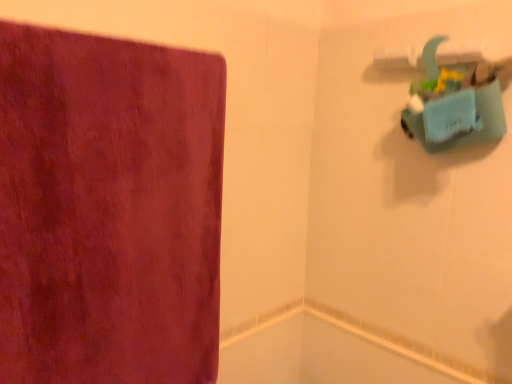
Measure the distance between point (301, 343) and camera.

Point (301, 343) and camera are 1.33 meters apart from each other.

I want to click on white glossy bath at lower center, so click(x=323, y=353).

What do you see at coordinates (323, 353) in the screenshot?
I see `white glossy bath at lower center` at bounding box center [323, 353].

What do you see at coordinates (108, 209) in the screenshot?
I see `velvet-like maroon towel at left` at bounding box center [108, 209].

The height and width of the screenshot is (384, 512). Identify the location of velvet-like maroon towel at left. (108, 209).

The height and width of the screenshot is (384, 512). What are the coordinates of `white glossy bath at lower center` in the screenshot? It's located at (323, 353).

Is velvet-like maroon towel at left at the right side of white glossy bath at lower center?

In fact, velvet-like maroon towel at left is to the left of white glossy bath at lower center.

Is velvet-like maroon towel at left positioned behind white glossy bath at lower center?

No, velvet-like maroon towel at left is closer to the viewer.

Considering the positions of point (150, 67) and point (333, 330), is point (150, 67) closer or farther from the camera than point (333, 330)?

Point (150, 67).

From the image's perspective, does velvet-like maroon towel at left appear lower than white glossy bath at lower center?

Actually, velvet-like maroon towel at left appears above white glossy bath at lower center in the image.

From a real-world perspective, who is located lower, velvet-like maroon towel at left or white glossy bath at lower center?

white glossy bath at lower center, from a real-world perspective.

Does velvet-like maroon towel at left have a lesser width compared to white glossy bath at lower center?

No, velvet-like maroon towel at left is not thinner than white glossy bath at lower center.

Who is taller, velvet-like maroon towel at left or white glossy bath at lower center?

Standing taller between the two is velvet-like maroon towel at left.

Is velvet-like maroon towel at left smaller than white glossy bath at lower center?

No, velvet-like maroon towel at left is not smaller than white glossy bath at lower center.

Can white glossy bath at lower center be found inside velvet-like maroon towel at left?

Actually, white glossy bath at lower center is outside velvet-like maroon towel at left.

Is velvet-like maroon towel at left placed right next to white glossy bath at lower center?

There is a gap between velvet-like maroon towel at left and white glossy bath at lower center.

Is velvet-like maroon towel at left positioned with its back to white glossy bath at lower center?

velvet-like maroon towel at left is not turned away from white glossy bath at lower center.

How many degrees apart are the facing directions of velvet-like maroon towel at left and white glossy bath at lower center?

90.1 degrees.

Measure the distance between velvet-like maroon towel at left and white glossy bath at lower center.

A distance of 20.97 inches exists between velvet-like maroon towel at left and white glossy bath at lower center.

Identify the location of towel in front of the white glossy bath at lower center. (108, 209).

Between white glossy bath at lower center and velvet-like maroon towel at left, which one appears on the right side from the viewer's perspective?

white glossy bath at lower center.

Between white glossy bath at lower center and velvet-like maroon towel at left, which one is positioned in front?

velvet-like maroon towel at left is in front.

Is point (366, 357) positioned in front of point (173, 305)?

No.

From the image's perspective, who appears lower, white glossy bath at lower center or velvet-like maroon towel at left?

From the image's view, white glossy bath at lower center is below.

From a real-world perspective, is white glossy bath at lower center on velvet-like maroon towel at left?

No, from a real-world perspective, white glossy bath at lower center is not over velvet-like maroon towel at left

Is white glossy bath at lower center wider or thinner than velvet-like maroon towel at left?

white glossy bath at lower center is thinner than velvet-like maroon towel at left.

Is white glossy bath at lower center taller or shorter than velvet-like maroon towel at left?

Considering their sizes, white glossy bath at lower center has less height than velvet-like maroon towel at left.

In terms of size, does white glossy bath at lower center appear bigger or smaller than velvet-like maroon towel at left?

Considering their sizes, white glossy bath at lower center takes up less space than velvet-like maroon towel at left.

Can we say white glossy bath at lower center lies outside velvet-like maroon towel at left?

Indeed, white glossy bath at lower center is completely outside velvet-like maroon towel at left.

Is there a large distance between white glossy bath at lower center and velvet-like maroon towel at left?

No, there isn't a large distance between white glossy bath at lower center and velvet-like maroon towel at left.

Is white glossy bath at lower center aimed at velvet-like maroon towel at left?

No, white glossy bath at lower center is not turned towards velvet-like maroon towel at left.

Consider the image. How different are the orientations of white glossy bath at lower center and velvet-like maroon towel at left in degrees?

90.1 degrees.

How much distance is there between white glossy bath at lower center and velvet-like maroon towel at left?

A distance of 20.97 inches exists between white glossy bath at lower center and velvet-like maroon towel at left.

Image resolution: width=512 pixels, height=384 pixels. What are the coordinates of `bath below the velvet-like maroon towel at left (from the image's perspective)` in the screenshot? It's located at (323, 353).

I want to click on bath to the right of velvet-like maroon towel at left, so pos(323,353).

Identify the location of bath behind the velvet-like maroon towel at left. The image size is (512, 384). (323, 353).